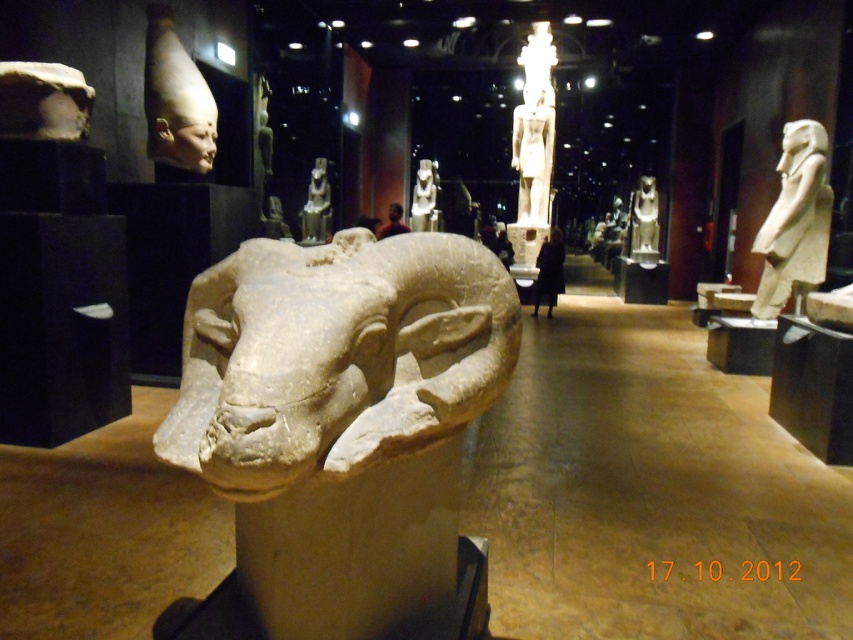
You are a visitor in the museum and want to take a photo of both the polished stone statue at center and the slate gray stone statue at center. Which statue should you stand closer to in order to capture both in a single frame?

You should stand closer to the polished stone statue at center because it is shorter than the slate gray stone statue at center, allowing both to fit within the camera frame more easily.

You are a visitor in the museum and want to take a photo of the stone sculpture of a ram head. You notice two points marked in the image at coordinates point (494, 376) and point (537, 198). Which point should you focus on to ensure the sculpture is in sharp focus?

You should focus on point (494, 376) because it is closer to the camera than point (537, 198), ensuring the sculpture is in sharp focus.

You are a museum security guard who needs to check the distance between the polished stone statue at center and the matte stone statue at center. According to the museum guidelines, the minimum distance between two statues should be 4 meters for safety. Is the current distance compliant with the guidelines?

The polished stone statue at center and the matte stone statue at center are 3.81 meters apart. Since the minimum required distance is 4 meters, the current distance is 0.19 meters shorter than the required distance. Therefore, it does not comply with the museum guidelines.